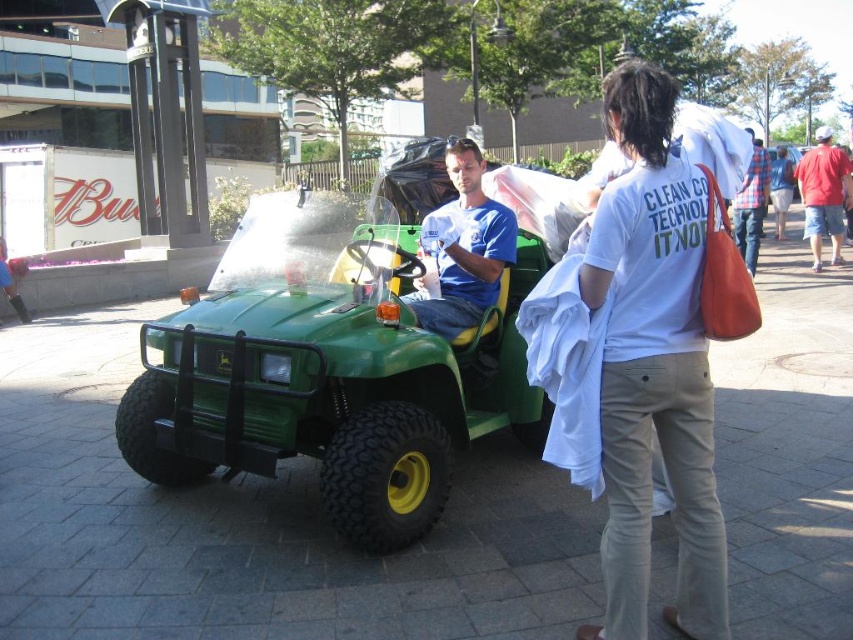
You are a delivery person who needs to park your van near the green matte utility vehicle at center without blocking the red cotton shirt at right. Based on the scene, where should you park your van?

You should park your van to the left of the green matte utility vehicle at center because it is positioned under the red cotton shirt at right, meaning the shirt is located above or behind the utility vehicle. Parking to the left would avoid blocking the red cotton shirt at right.

You are a security guard observing the scene. There are two people in the image, one wearing a matte blue shirt at center and another in a flannel plaid shirt at right. Which person is closer to you?

The matte blue shirt at center is closer to you because the flannel plail shirt at right is behind it.

You are standing in the outdoor urban setting shown in the image. You need to locate the flannel plaid shirt at right. Where exactly should you look?

The flannel plaid shirt at right is located at point 0.320 on the x axis and 0.882 on the y axis.